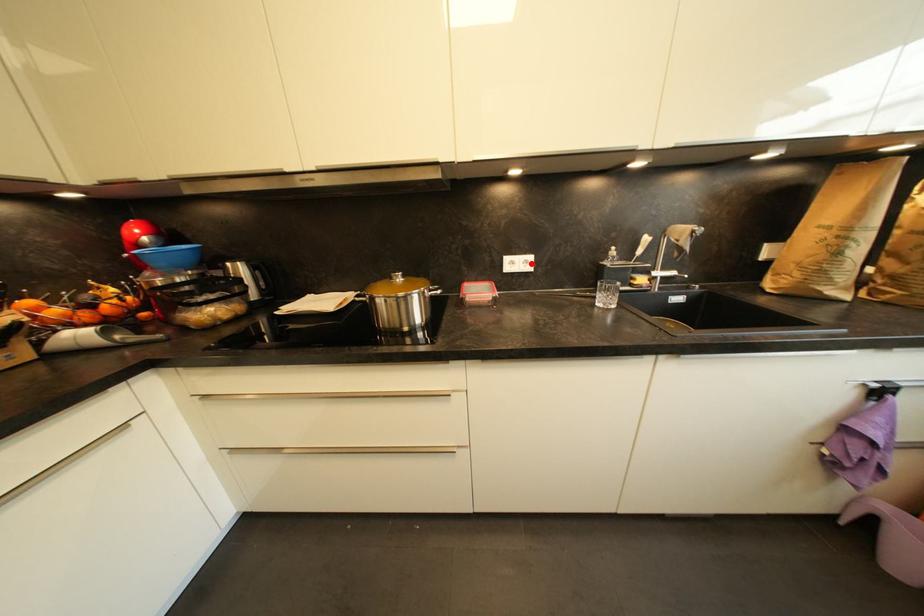
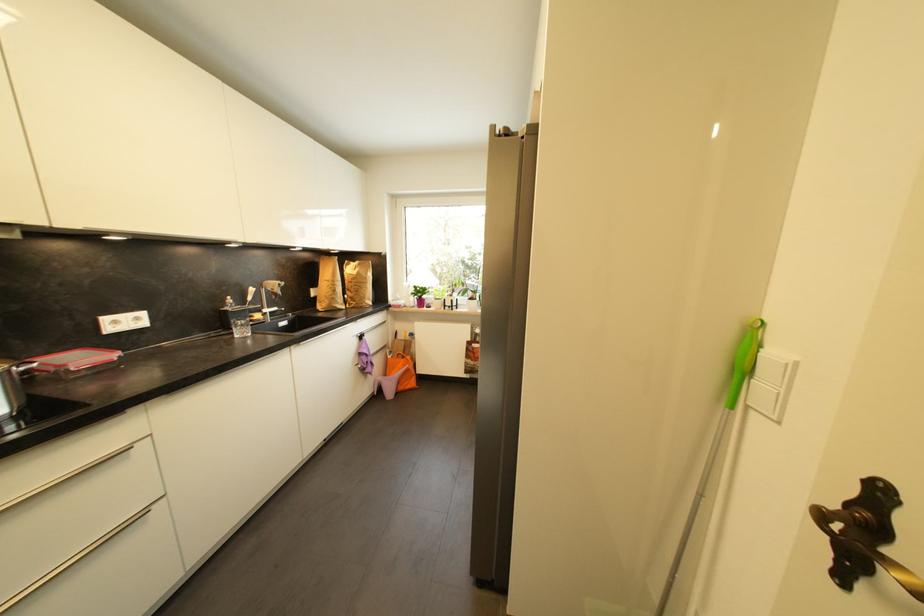
In the second image, find the point that corresponds to the highlighted location in the first image.

(142, 321)